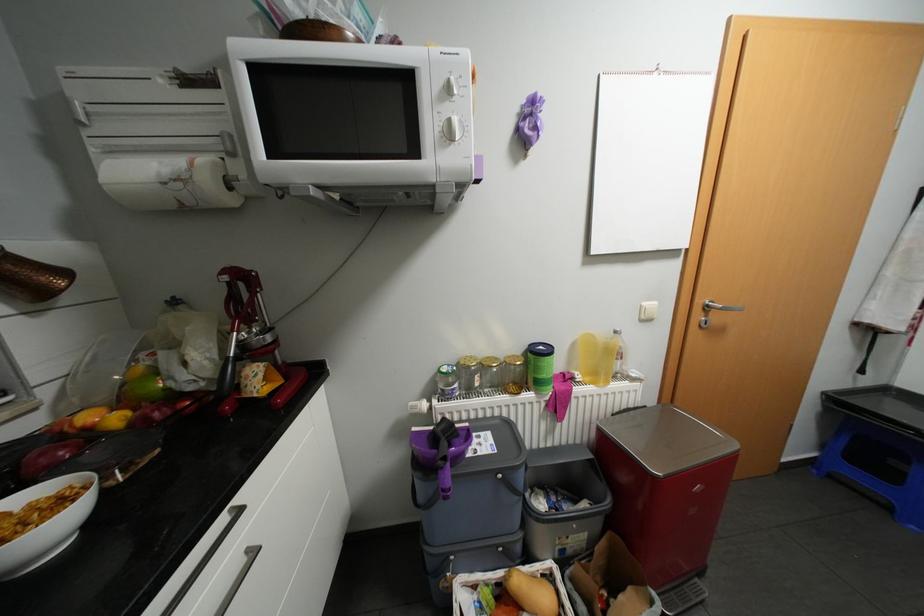
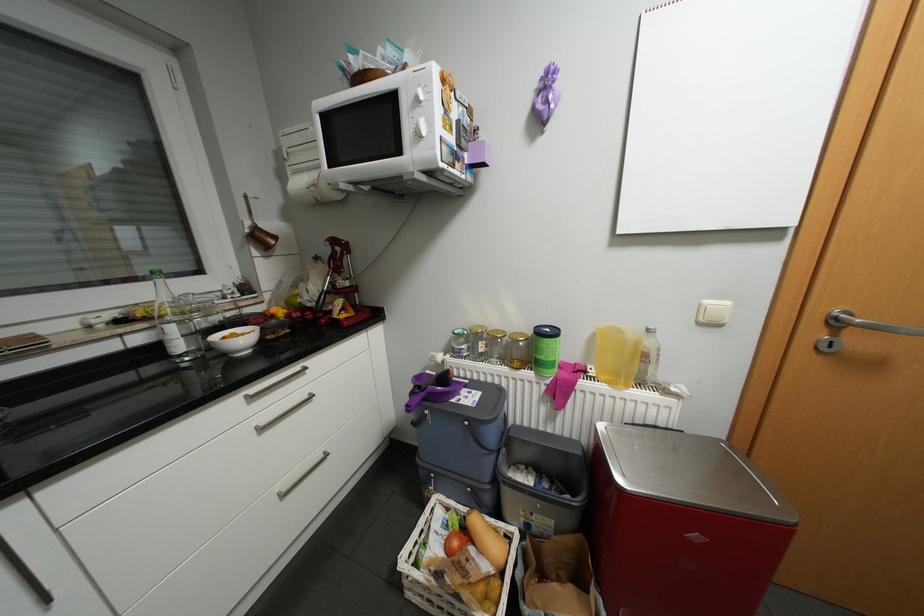
In the second image, find the point that corresponds to point (587, 377) in the first image.

(600, 371)